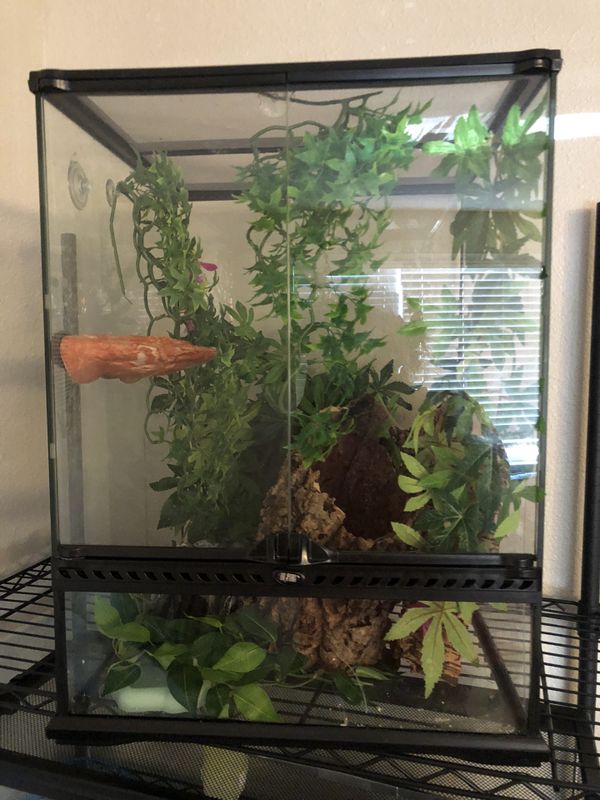
The height and width of the screenshot is (800, 600). In order to click on ceiling in this screenshot , I will do `click(307, 32)`.